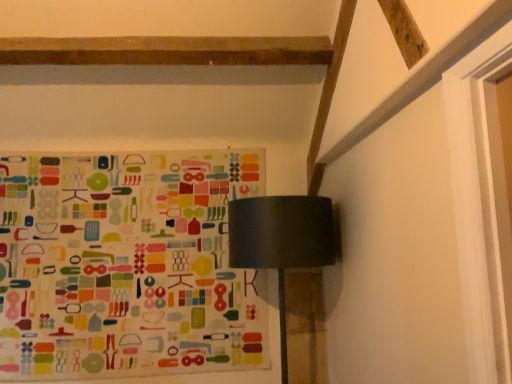
Question: Does multicolored fabric bulletin board at upper center have a lesser height compared to matte black lampshade at upper center?

Choices:
 (A) yes
 (B) no

Answer: (B)

Question: Is multicolored fabric bulletin board at upper center in front of matte black lampshade at upper center?

Choices:
 (A) no
 (B) yes

Answer: (A)

Question: Can you confirm if multicolored fabric bulletin board at upper center is smaller than matte black lampshade at upper center?

Choices:
 (A) yes
 (B) no

Answer: (A)

Question: From the image's perspective, would you say multicolored fabric bulletin board at upper center is shown under matte black lampshade at upper center?

Choices:
 (A) yes
 (B) no

Answer: (B)

Question: From a real-world perspective, is multicolored fabric bulletin board at upper center below matte black lampshade at upper center?

Choices:
 (A) no
 (B) yes

Answer: (A)

Question: Can you confirm if multicolored fabric bulletin board at upper center is wider than matte black lampshade at upper center?

Choices:
 (A) yes
 (B) no

Answer: (B)

Question: From the image's perspective, is matte black lampshade at upper center over multicolored fabric bulletin board at upper center?

Choices:
 (A) no
 (B) yes

Answer: (A)

Question: From a real-world perspective, is matte black lampshade at upper center positioned under multicolored fabric bulletin board at upper center based on gravity?

Choices:
 (A) yes
 (B) no

Answer: (A)

Question: Does matte black lampshade at upper center have a greater width compared to multicolored fabric bulletin board at upper center?

Choices:
 (A) yes
 (B) no

Answer: (A)

Question: Is matte black lampshade at upper center turned away from multicolored fabric bulletin board at upper center?

Choices:
 (A) no
 (B) yes

Answer: (A)

Question: Is the surface of matte black lampshade at upper center in direct contact with multicolored fabric bulletin board at upper center?

Choices:
 (A) no
 (B) yes

Answer: (A)

Question: Would you say matte black lampshade at upper center contains multicolored fabric bulletin board at upper center?

Choices:
 (A) no
 (B) yes

Answer: (A)

Question: Considering the positions of matte black lampshade at upper center and multicolored fabric bulletin board at upper center in the image, is matte black lampshade at upper center taller or shorter than multicolored fabric bulletin board at upper center?

Choices:
 (A) tall
 (B) short

Answer: (B)